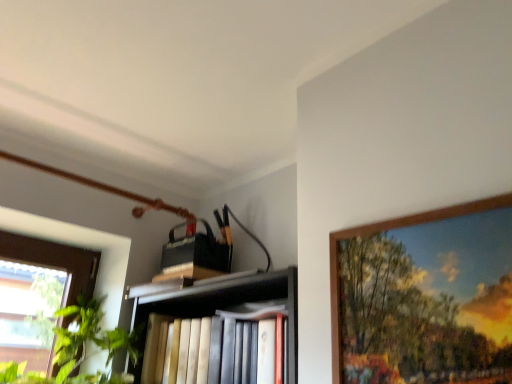
Question: Would you say wooden picture frame at upper right is to the left or to the right of hardcover books at center in the picture?

Choices:
 (A) right
 (B) left

Answer: (A)

Question: Which is correct: wooden picture frame at upper right is inside hardcover books at center, or outside of it?

Choices:
 (A) outside
 (B) inside

Answer: (A)

Question: Considering the positions of wooden picture frame at upper right and hardcover books at center in the image, is wooden picture frame at upper right wider or thinner than hardcover books at center?

Choices:
 (A) thin
 (B) wide

Answer: (A)

Question: Considering the relative positions of hardcover books at center and wooden picture frame at upper right in the image provided, is hardcover books at center to the left or to the right of wooden picture frame at upper right?

Choices:
 (A) right
 (B) left

Answer: (B)

Question: Is hardcover books at center inside the boundaries of wooden picture frame at upper right, or outside?

Choices:
 (A) inside
 (B) outside

Answer: (B)

Question: Considering the positions of hardcover books at center and wooden picture frame at upper right in the image, is hardcover books at center taller or shorter than wooden picture frame at upper right?

Choices:
 (A) short
 (B) tall

Answer: (A)

Question: Considering the positions of point (203, 288) and point (485, 294), is point (203, 288) closer or farther from the camera than point (485, 294)?

Choices:
 (A) farther
 (B) closer

Answer: (A)